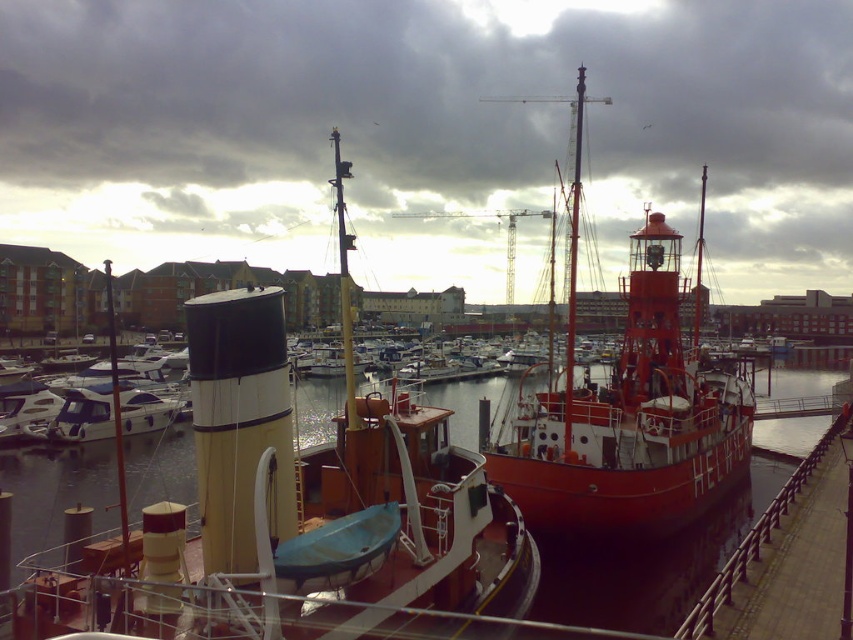
Is shiny red boat at center taller than glossy water at center?

Correct, shiny red boat at center is much taller as glossy water at center.

Which of these two, shiny red boat at center or glossy water at center, stands taller?

shiny red boat at center is taller.

The width and height of the screenshot is (853, 640). I want to click on shiny red boat at center, so click(x=627, y=412).

Locate an element on the screen. This screenshot has width=853, height=640. shiny red boat at center is located at coordinates (627, 412).

Is matte yellow and black smokestack at center in front of glossy water at center?

Yes, it is in front of glossy water at center.

Is point (91, 545) farther from viewer compared to point (310, 397)?

That is False.

Locate an element on the screen. The width and height of the screenshot is (853, 640). matte yellow and black smokestack at center is located at coordinates (292, 515).

Who is lower down, matte yellow and black smokestack at center or shiny red boat at center?

Positioned lower is matte yellow and black smokestack at center.

Between point (198, 625) and point (640, 516), which one is positioned in front?

Point (198, 625) is in front.

Where is `matte yellow and black smokestack at center`? The image size is (853, 640). matte yellow and black smokestack at center is located at coordinates (292, 515).